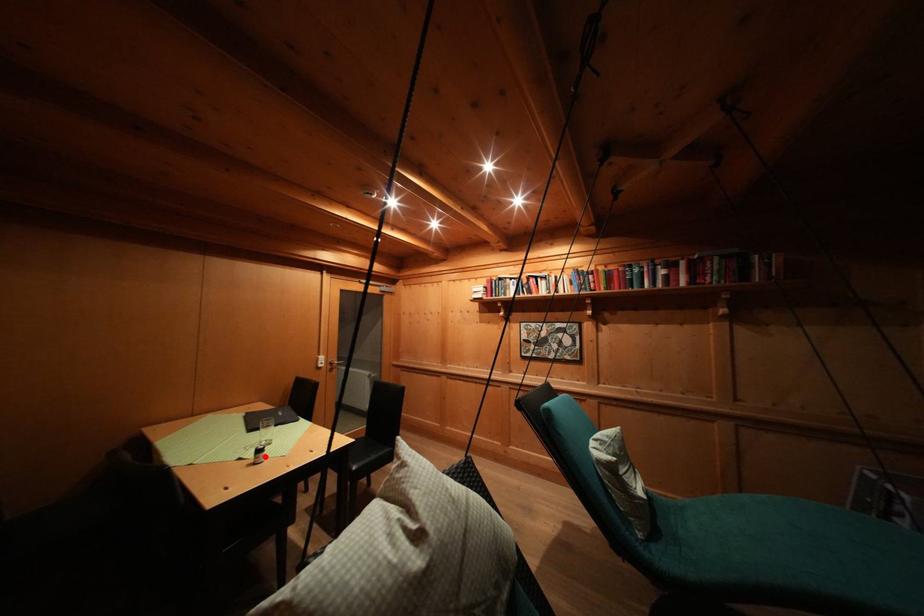
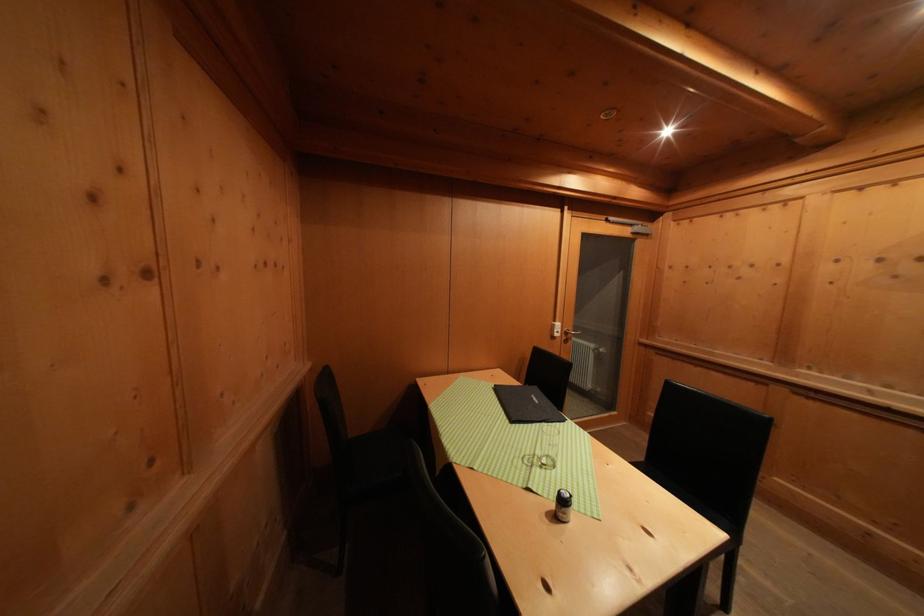
In the second image, find the point that corresponds to the highlighted location in the first image.

(569, 506)